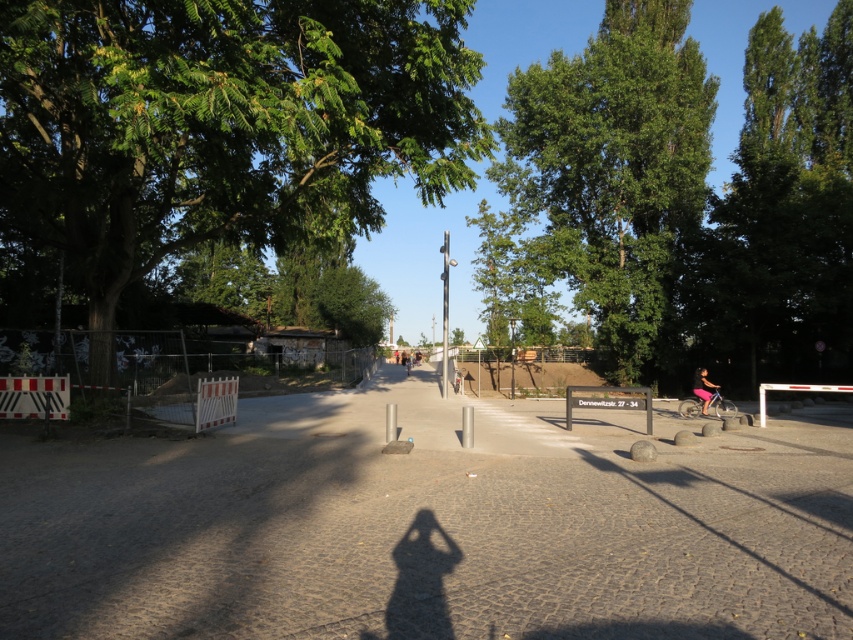
Is green leafy tree at left wider than green leafy tree at center?

Yes.

Is green leafy tree at left closer to camera compared to green leafy tree at center?

Yes, green leafy tree at left is closer to the viewer.

Describe the element at coordinates (222, 124) in the screenshot. I see `green leafy tree at left` at that location.

Where is `green leafy tree at left`? This screenshot has height=640, width=853. green leafy tree at left is located at coordinates (222, 124).

Does point (257, 113) lie in front of point (445, 301)?

Yes.

Who is shorter, green leafy tree at left or smooth metal pole at center?

green leafy tree at left is shorter.

What do you see at coordinates (222, 124) in the screenshot?
I see `green leafy tree at left` at bounding box center [222, 124].

Image resolution: width=853 pixels, height=640 pixels. I want to click on green leafy tree at left, so click(222, 124).

Is dirt track at center above green leafy tree at left?

No, dirt track at center is not above green leafy tree at left.

Can you confirm if dirt track at center is wider than green leafy tree at left?

No, dirt track at center is not wider than green leafy tree at left.

Who is more forward, (483, 605) or (15, 182)?

Point (483, 605) is more forward.

At what (x,y) coordinates should I click in order to perform the action: click on dirt track at center. Please return your answer as a coordinate pair (x, y). Looking at the image, I should click on (430, 525).